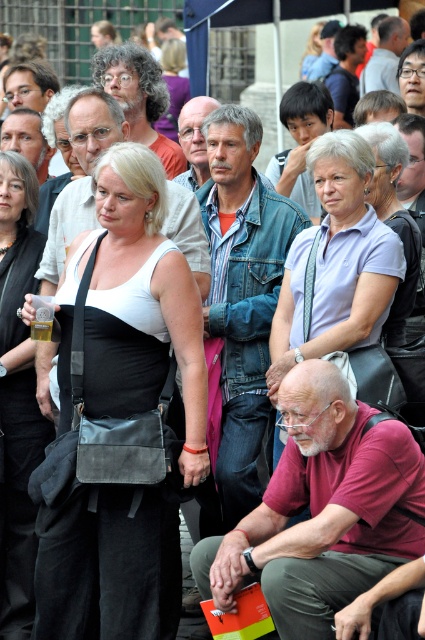
Question: Which point is farther from the camera taking this photo?

Choices:
 (A) (2, 435)
 (B) (328, 198)

Answer: (A)

Question: Which of the following is the closest to the observer?

Choices:
 (A) black leather bag at center
 (B) light purple fabric shirt at upper center
 (C) matte black bag at center

Answer: (C)

Question: In this image, where is matte black bag at center located relative to black leather bag at center?

Choices:
 (A) left
 (B) right

Answer: (B)

Question: Among these objects, which one is nearest to the camera?

Choices:
 (A) light purple fabric shirt at upper center
 (B) matte black bag at center
 (C) black leather bag at center

Answer: (B)

Question: Does light purple fabric shirt at upper center appear on the right side of black leather bag at center?

Choices:
 (A) no
 (B) yes

Answer: (B)

Question: Is light purple fabric shirt at upper center behind black leather bag at center?

Choices:
 (A) yes
 (B) no

Answer: (A)